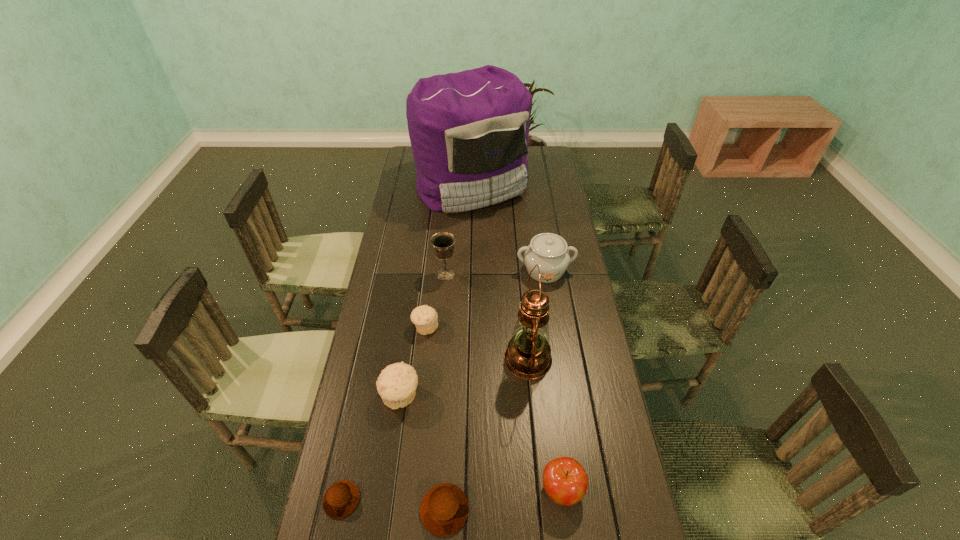
You are a GUI agent. You are given a task and a screenshot of the screen. Output one action in this format:
    pyautogui.click(x=<x>, y=<y>)
    Task: Click on the right brown muffin
    This screenshot has height=540, width=960.
    Given the screenshot: What is the action you would take?
    pyautogui.click(x=444, y=509)

Locate an element on the screen. the second shortest muffin is located at coordinates (444, 509).

I want to click on the smaller brown muffin, so click(341, 498).

Locate an element on the screen. The height and width of the screenshot is (540, 960). the shortest muffin is located at coordinates (341, 498).

Where is `vacant space located 0.260m on the front pocket of the tallest object`? vacant space located 0.260m on the front pocket of the tallest object is located at coordinates (470, 264).

Identify the location of vacant space located 0.340m on the left of the oil lamp. (396, 359).

Image resolution: width=960 pixels, height=540 pixels. Find the location of `vacant space situated 0.250m on the back of the chalice`. vacant space situated 0.250m on the back of the chalice is located at coordinates (449, 225).

Identify the location of free spot located 0.250m on the back of the chinaware. (537, 217).

At what (x,y) coordinates should I click in order to perform the action: click on vacant space located 0.170m on the front of the third nearest muffin. Please return your answer as a coordinate pair (x, y). The image size is (960, 540). Looking at the image, I should click on (389, 476).

Locate an element on the screen. Image resolution: width=960 pixels, height=540 pixels. blank space located on the back of the apple is located at coordinates (555, 431).